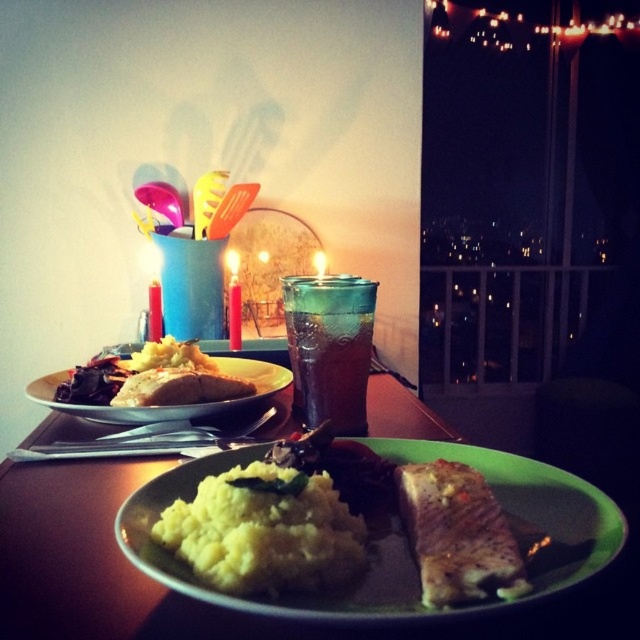
Question: Which of the following is the closest to the observer?

Choices:
 (A) golden brown steak at center
 (B) golden mashed potatoes at left

Answer: (A)

Question: Does golden brown steak at center have a larger size compared to golden mashed potatoes at left?

Choices:
 (A) yes
 (B) no

Answer: (B)

Question: Does green plate at center have a lesser width compared to yellow mashed potatoes at center?

Choices:
 (A) no
 (B) yes

Answer: (A)

Question: Which point is farther to the camera?

Choices:
 (A) yellow mashed potato at center
 (B) white matte plate at center

Answer: (B)

Question: Which is nearer to the yellow mashed potatoes at center?

Choices:
 (A) green plate at center
 (B) yellow mashed potato at center
 (C) golden brown steak at center
 (D) white matte plate at center

Answer: (B)

Question: Can you confirm if golden brown steak at center is smaller than white matte plate at center?

Choices:
 (A) no
 (B) yes

Answer: (B)